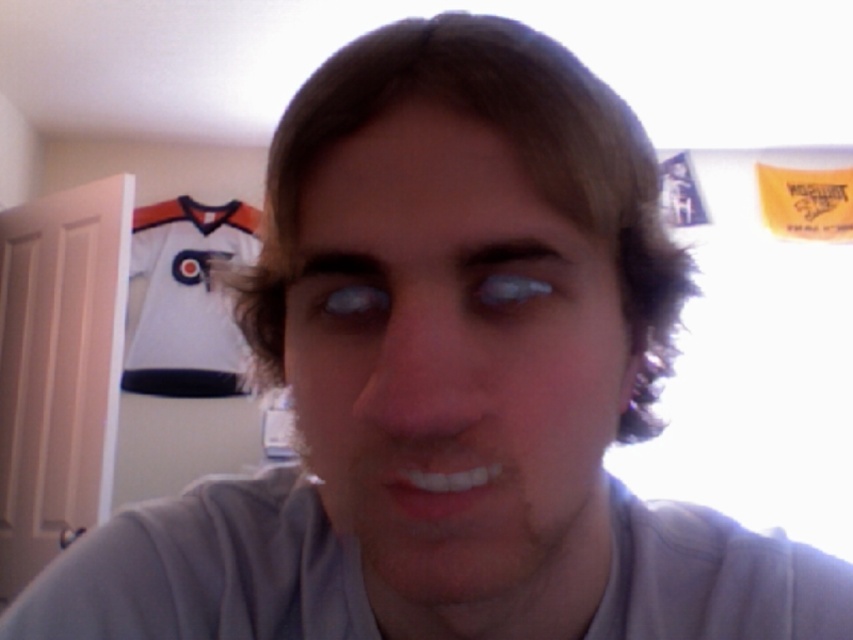
Question: Which of the following is the closest to the observer?

Choices:
 (A) (213, 560)
 (B) (215, 244)

Answer: (A)

Question: Which point is farther to the camera?

Choices:
 (A) white glossy teeth at center
 (B) gray cotton shirt at center

Answer: (B)

Question: Is white glossy teeth at center to the right of blue matte eye at center from the viewer's perspective?

Choices:
 (A) no
 (B) yes

Answer: (B)

Question: Can you confirm if matte gray face at center is positioned to the left of white glossy teeth at center?

Choices:
 (A) yes
 (B) no

Answer: (B)

Question: Is the position of matte gray face at center more distant than that of gray cotton shirt at center?

Choices:
 (A) yes
 (B) no

Answer: (B)

Question: Which point is closer to the camera?

Choices:
 (A) translucent plastic eye at center
 (B) matte gray face at center
 (C) white jersey at upper left
 (D) gray cotton shirt at center

Answer: (B)